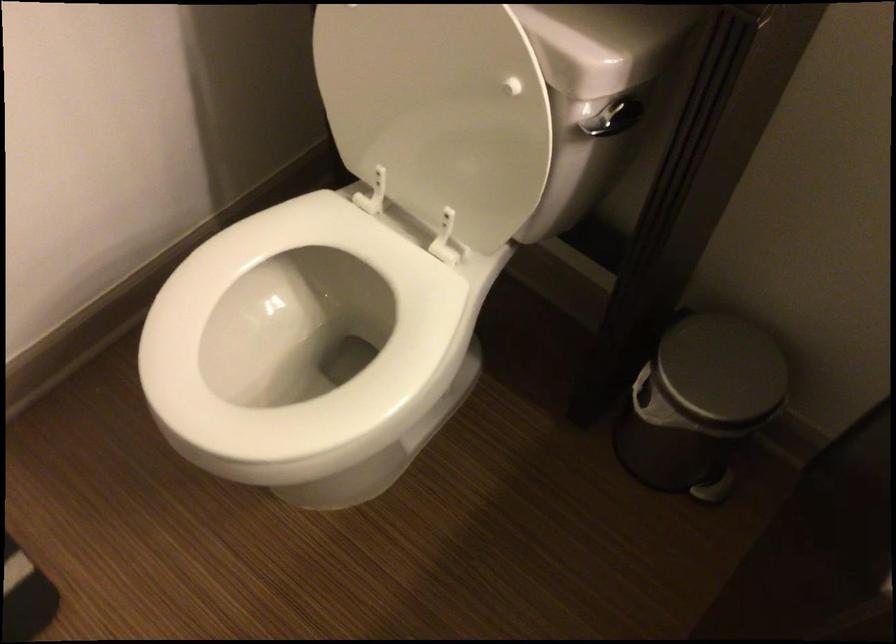
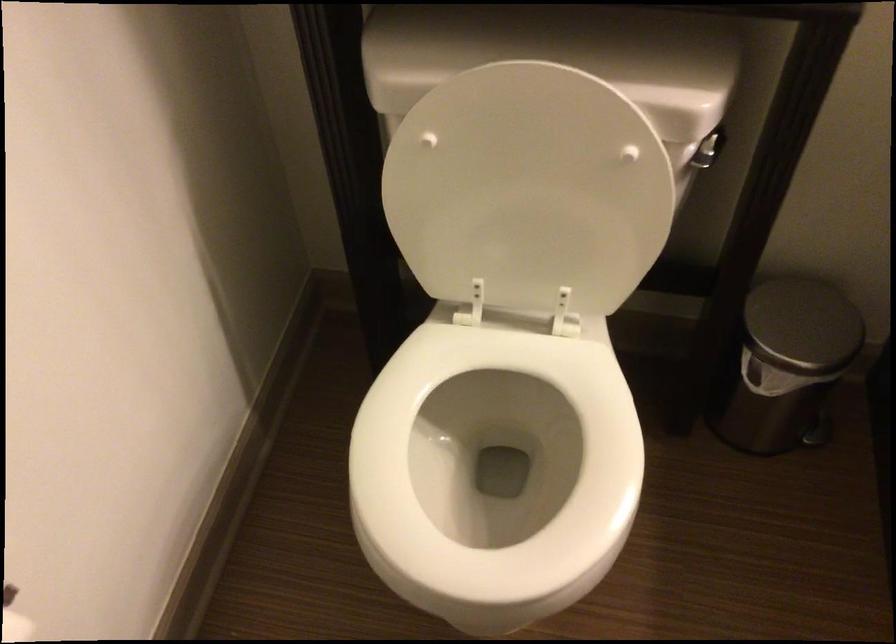
Question: Based on the continuous images, in which direction is the camera rotating? Reply with the corresponding letter.

Choices:
 (A) Left
 (B) Right
 (C) Up
 (D) Down

Answer: (B)